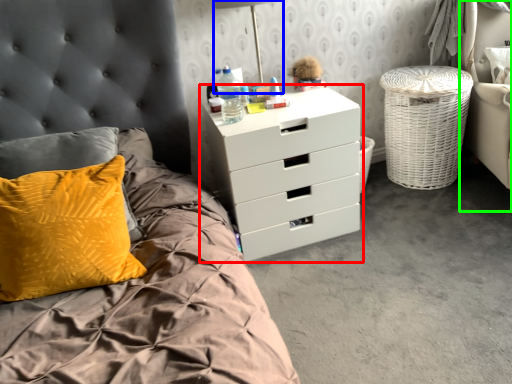
Question: Estimate the real-world distances between objects in this image. Which object is closer to chest of drawers (highlighted by a red box), bedside lamp (highlighted by a blue box) or armchair (highlighted by a green box)?

Choices:
 (A) bedside lamp
 (B) armchair

Answer: (A)